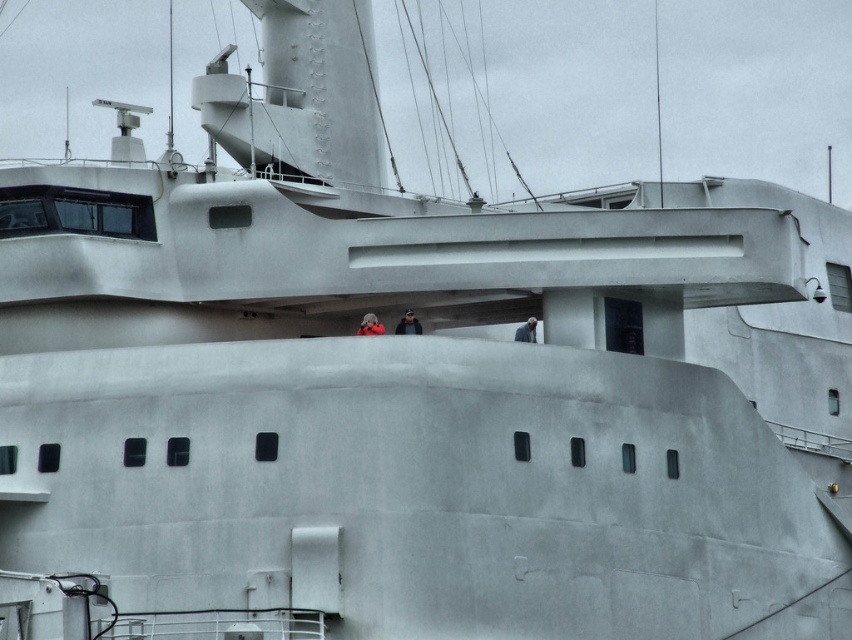
Consider the image. Is red fabric person at center taller than smooth gray jacket at center?

In fact, red fabric person at center may be shorter than smooth gray jacket at center.

What are the coordinates of `red fabric person at center` in the screenshot? It's located at (369, 324).

Where is `red fabric person at center`? This screenshot has width=852, height=640. red fabric person at center is located at coordinates (369, 324).

Measure the distance from dark gray fabric jacket at center to smooth gray jacket at center.

dark gray fabric jacket at center is 4.88 meters from smooth gray jacket at center.

Does point (401, 317) come closer to viewer compared to point (527, 339)?

No, it is behind (527, 339).

Locate an element on the screen. dark gray fabric jacket at center is located at coordinates (407, 324).

Does dark gray fabric jacket at center appear on the right side of red fabric person at center?

Indeed, dark gray fabric jacket at center is positioned on the right side of red fabric person at center.

Which of these two, dark gray fabric jacket at center or red fabric person at center, stands taller?

With more height is dark gray fabric jacket at center.

Between point (406, 316) and point (373, 328), which one is positioned in front?

Point (373, 328)

Identify the location of dark gray fabric jacket at center. [407, 324].